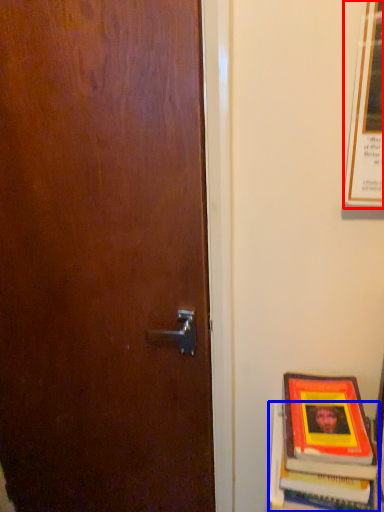
Question: Which of the following is the farthest to the observer, poster (highlighted by a red box) or book (highlighted by a blue box)?

Choices:
 (A) poster
 (B) book

Answer: (B)